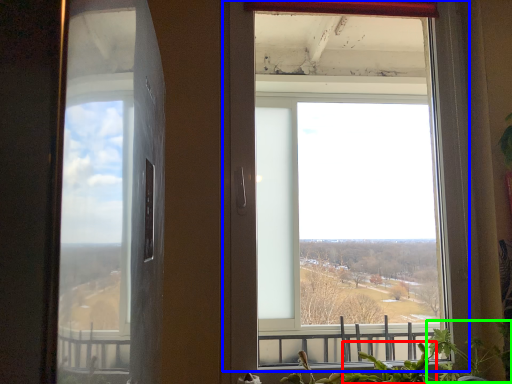
Question: Estimate the real-world distances between objects in this image. Which object is closer to plant (highlighted by a red box), window (highlighted by a blue box) or plant (highlighted by a green box)?

Choices:
 (A) window
 (B) plant

Answer: (B)